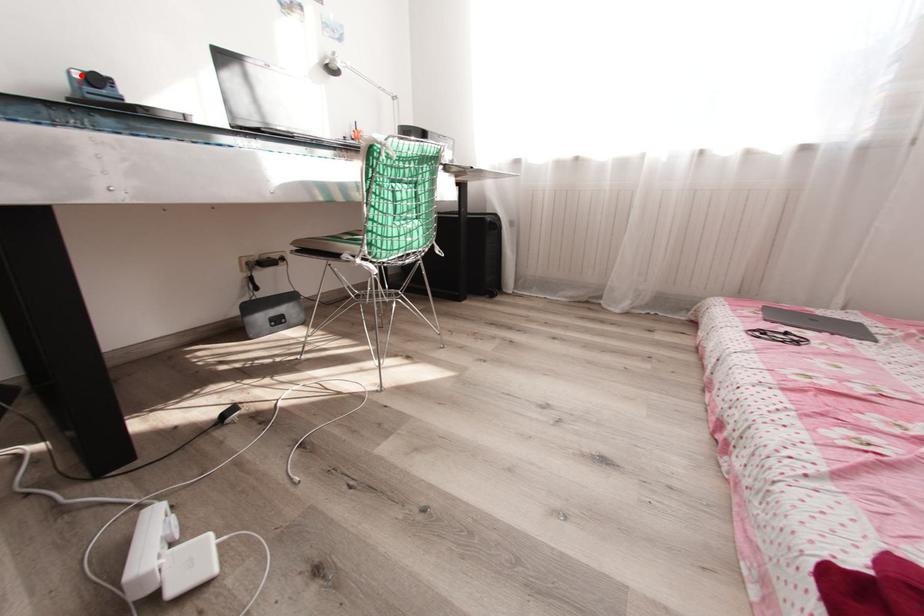
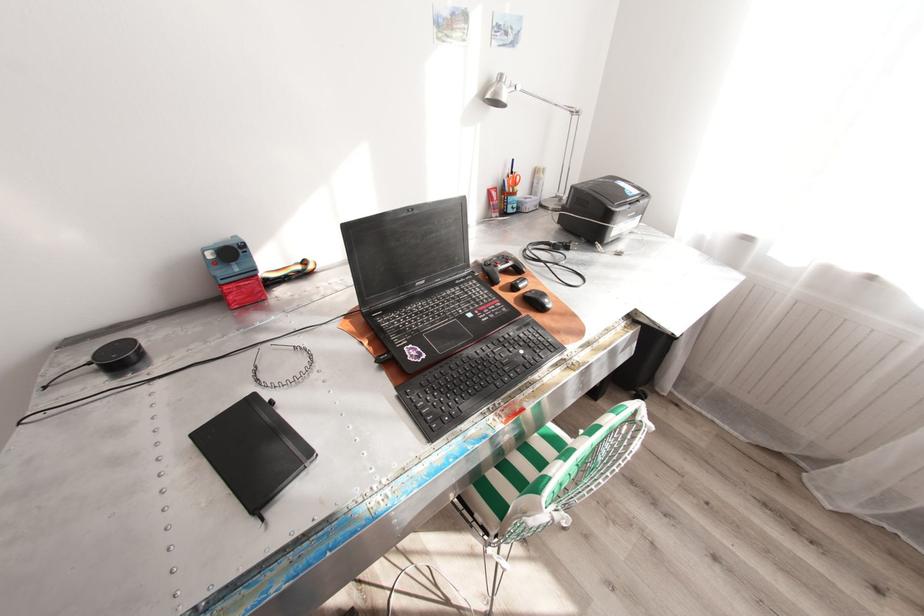
Locate, in the second image, the point that corresponds to the highlighted location in the first image.

(215, 254)